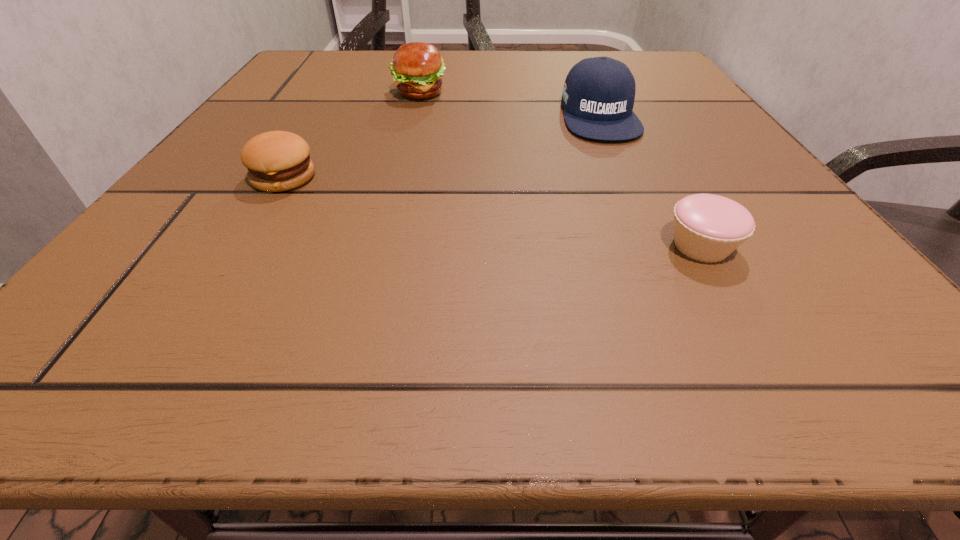
At what (x,y) coordinates should I click in order to perform the action: click on object that is the third closest to the nearer hamburger. Please return your answer as a coordinate pair (x, y). This screenshot has height=540, width=960. Looking at the image, I should click on point(708,228).

Identify which object is the nearest to the baseball cap. Please provide its 2D coordinates. Your answer should be formatted as a tuple, i.e. [(x, y)], where the tuple contains the x and y coordinates of a point satisfying the conditions above.

[(708, 228)]

Find the location of a particular element. vacant space that satisfies the following two spatial constraints: 1. on the front side of the farther hamburger; 2. on the left side of the nearest object is located at coordinates (381, 245).

Find the location of a particular element. Image resolution: width=960 pixels, height=540 pixels. free space that satisfies the following two spatial constraints: 1. on the front-facing side of the nearest object; 2. on the left side of the baseball cap is located at coordinates (658, 245).

Identify the location of free space that satisfies the following two spatial constraints: 1. on the back side of the nearer hamburger; 2. on the right side of the taller hamburger. This screenshot has width=960, height=540. (x=334, y=93).

Find the location of a particular element. This screenshot has width=960, height=540. free region that satisfies the following two spatial constraints: 1. on the front-facing side of the baseball cap; 2. on the right side of the nearest object is located at coordinates (658, 245).

The height and width of the screenshot is (540, 960). I want to click on free spot that satisfies the following two spatial constraints: 1. on the front-facing side of the baseball cap; 2. on the right side of the cupcake, so click(658, 245).